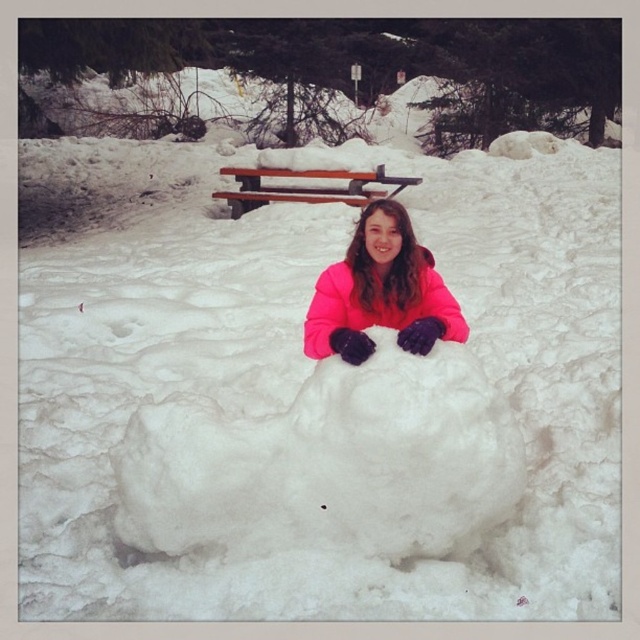
Question: Which of the following is the farthest from the observer?

Choices:
 (A) brown wooden bench at upper center
 (B) white fluffy snowball at center

Answer: (A)

Question: Which point is closer to the camera?

Choices:
 (A) brown wooden bench at upper center
 (B) white fluffy snowball at center

Answer: (B)

Question: Observing the image, what is the correct spatial positioning of white fluffy snowball at center in reference to brown wooden bench at upper center?

Choices:
 (A) below
 (B) above

Answer: (A)

Question: Is white fluffy snowball at center thinner than pink fleece jacket at center?

Choices:
 (A) yes
 (B) no

Answer: (B)

Question: Does white fluffy snowball at center appear over pink fleece jacket at center?

Choices:
 (A) no
 (B) yes

Answer: (A)

Question: Which object is farther from the camera taking this photo?

Choices:
 (A) brown wooden bench at upper center
 (B) pink fleece jacket at center
 (C) white fluffy snowball at center

Answer: (A)